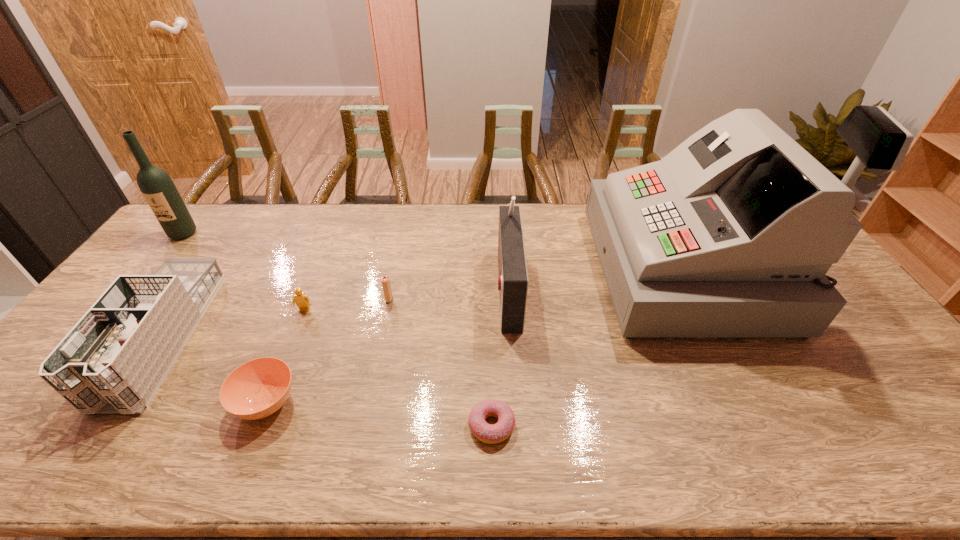
Where is `vacant space that satisfies the following two spatial constraints: 1. at the entrance of the second object from left to right; 2. on the left side of the doughnut`? vacant space that satisfies the following two spatial constraints: 1. at the entrance of the second object from left to right; 2. on the left side of the doughnut is located at coordinates (104, 426).